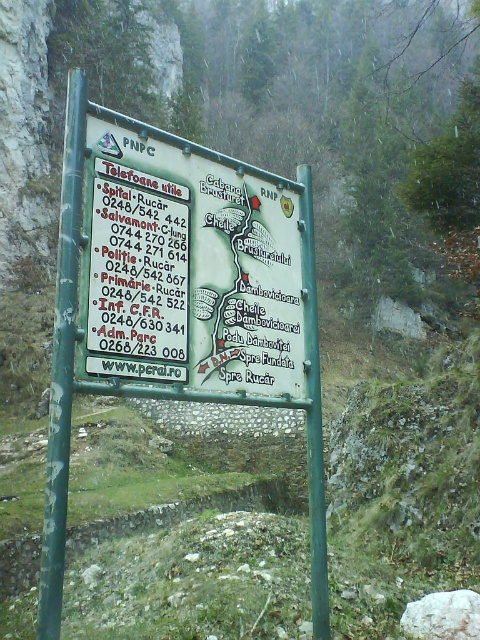
You are standing in front of the signboard and notice two green poles supporting it. The poles are labeled as the green painted metal pole at left and the green metallic pole at center. Which pole is positioned higher relative to the other?

The green painted metal pole at left is located above the green metallic pole at center, meaning it is positioned higher than the latter.

You are a hiker who needs to know if the green metal sign at center is taller than the green painted metal pole at left. Based on the scene, can you determine which one is taller?

The green metal sign at center is not as tall as the green painted metal pole at left, so the green painted metal pole at left is taller.